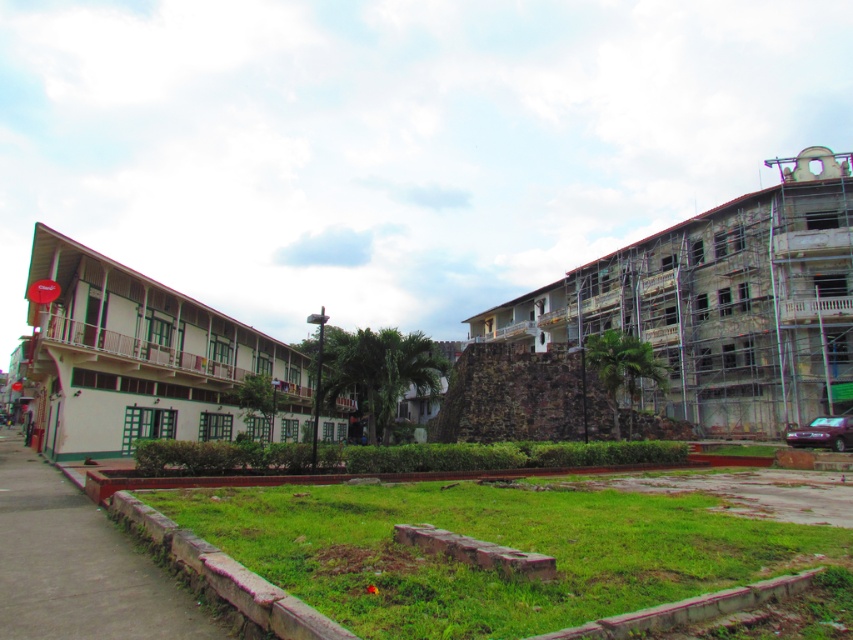
Question: Does green grass at center have a smaller size compared to concrete sidewalk at lower left?

Choices:
 (A) yes
 (B) no

Answer: (A)

Question: Can you confirm if green grass at center is positioned below concrete sidewalk at lower left?

Choices:
 (A) no
 (B) yes

Answer: (A)

Question: Does green grass at center appear on the left side of stone textured wall at right?

Choices:
 (A) yes
 (B) no

Answer: (A)

Question: Which point is closer to the camera taking this photo?

Choices:
 (A) (850, 243)
 (B) (202, 385)
 (C) (769, 573)

Answer: (C)

Question: Which point appears closest to the camera in this image?

Choices:
 (A) (483, 584)
 (B) (86, 349)
 (C) (222, 628)
 (D) (683, 264)

Answer: (C)

Question: Which point appears farthest from the camera in this image?

Choices:
 (A) (109, 570)
 (B) (244, 499)
 (C) (119, 356)
 (D) (643, 284)

Answer: (D)